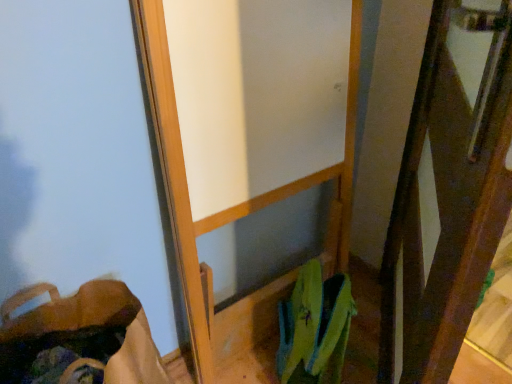
Question: Is brown fabric shoulder bag at lower left turned away from brown wooden screen door at right?

Choices:
 (A) yes
 (B) no

Answer: (B)

Question: Is brown fabric shoulder bag at lower left further to camera compared to brown wooden screen door at right?

Choices:
 (A) no
 (B) yes

Answer: (B)

Question: Does brown fabric shoulder bag at lower left turn towards brown wooden screen door at right?

Choices:
 (A) yes
 (B) no

Answer: (B)

Question: Does brown fabric shoulder bag at lower left have a lesser width compared to brown wooden screen door at right?

Choices:
 (A) no
 (B) yes

Answer: (A)

Question: Considering the relative sizes of brown fabric shoulder bag at lower left and brown wooden screen door at right in the image provided, is brown fabric shoulder bag at lower left wider than brown wooden screen door at right?

Choices:
 (A) yes
 (B) no

Answer: (A)

Question: From the image's perspective, is brown fabric shoulder bag at lower left over brown wooden screen door at right?

Choices:
 (A) yes
 (B) no

Answer: (B)

Question: Is brown wooden screen door at right completely or partially outside of brown fabric shoulder bag at lower left?

Choices:
 (A) no
 (B) yes

Answer: (B)

Question: Does brown wooden screen door at right come in front of brown fabric shoulder bag at lower left?

Choices:
 (A) yes
 (B) no

Answer: (A)

Question: From the image's perspective, is brown wooden screen door at right beneath brown fabric shoulder bag at lower left?

Choices:
 (A) yes
 (B) no

Answer: (B)

Question: Considering the relative positions of brown wooden screen door at right and brown fabric shoulder bag at lower left in the image provided, is brown wooden screen door at right to the left of brown fabric shoulder bag at lower left from the viewer's perspective?

Choices:
 (A) yes
 (B) no

Answer: (B)

Question: Is brown wooden screen door at right wider than brown fabric shoulder bag at lower left?

Choices:
 (A) no
 (B) yes

Answer: (A)

Question: Can you confirm if brown wooden screen door at right is smaller than brown fabric shoulder bag at lower left?

Choices:
 (A) yes
 (B) no

Answer: (B)

Question: From the image's perspective, relative to brown wooden screen door at right, is brown fabric shoulder bag at lower left above or below?

Choices:
 (A) below
 (B) above

Answer: (A)